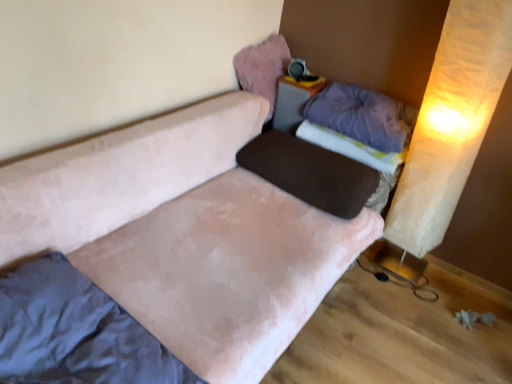
What do you see at coordinates (451, 121) in the screenshot?
I see `beige paper curtain at right` at bounding box center [451, 121].

This screenshot has width=512, height=384. Identify the location of beige paper curtain at right. (451, 121).

What do you see at coordinates (185, 234) in the screenshot?
I see `velvet pink couch at center` at bounding box center [185, 234].

Measure the distance between point (298, 136) and camera.

Point (298, 136) and camera are 7.21 feet apart from each other.

Where is `purple fabric mattress at upper right, the first mattress when ordered from back to front`? The image size is (512, 384). purple fabric mattress at upper right, the first mattress when ordered from back to front is located at coordinates (350, 147).

The height and width of the screenshot is (384, 512). Describe the element at coordinates (293, 101) in the screenshot. I see `matte plastic table at upper center` at that location.

The height and width of the screenshot is (384, 512). What do you see at coordinates (75, 332) in the screenshot?
I see `suede-like beige mattress at lower left, the second mattress in the top-to-bottom sequence` at bounding box center [75, 332].

Describe the element at coordinates (357, 116) in the screenshot. The width and height of the screenshot is (512, 384). I see `purple soft pillow at upper right, the 2th pillow ordered from the bottom` at that location.

I want to click on purple soft pillow at upper right, the 2th pillow ordered from the bottom, so click(x=357, y=116).

At what (x,y) coordinates should I click in order to perform the action: click on velvet pink pillow at upper center, the 1th pillow in the top-to-bottom sequence. Please return your answer as a coordinate pair (x, y). Image resolution: width=512 pixels, height=384 pixels. Looking at the image, I should click on (263, 68).

What do you see at coordinates (310, 172) in the screenshot?
I see `brown fabric pillow at center, which ranks as the first pillow in bottom-to-top order` at bounding box center [310, 172].

The height and width of the screenshot is (384, 512). Find the location of `beige paper curtain at right`. beige paper curtain at right is located at coordinates (451, 121).

Considering the positions of points (412, 203) and (314, 90), is point (412, 203) closer to camera compared to point (314, 90)?

Yes.

You are a GUI agent. You are given a task and a screenshot of the screen. Output one action in this format:
    pyautogui.click(x=<x>, y=<y>)
    Task: Click on the table above the beige paper curtain at right (from the image's perspective)
    This screenshot has width=512, height=384.
    Given the screenshot: What is the action you would take?
    293,101

Which is behind, beige paper curtain at right or matte plastic table at upper center?

matte plastic table at upper center is further away from the camera.

Is beige paper curtain at right looking in the opposite direction of matte plastic table at upper center?

beige paper curtain at right is not turned away from matte plastic table at upper center.

From the image's perspective, which object appears higher, velvet pink pillow at upper center, arranged as the third pillow when ordered from the bottom, or matte plastic table at upper center?

velvet pink pillow at upper center, arranged as the third pillow when ordered from the bottom, appears higher in the image.

Could you tell me if velvet pink pillow at upper center, the 1th pillow in the top-to-bottom sequence, is turned towards matte plastic table at upper center?

No.

Considering the points (266, 54) and (317, 80), which point is behind, point (266, 54) or point (317, 80)?

The point (266, 54) is farther.

In the scene shown: Who is taller, velvet pink pillow at upper center, arranged as the third pillow when ordered from the bottom, or matte plastic table at upper center?

With more height is matte plastic table at upper center.

From a real-world perspective, is velvet pink pillow at upper center, arranged as the third pillow when ordered from the bottom, located beneath brown fabric pillow at center, the 3th pillow viewed from the top?

No, from a real-world perspective, velvet pink pillow at upper center, arranged as the third pillow when ordered from the bottom, is not below brown fabric pillow at center, the 3th pillow viewed from the top.

Is velvet pink pillow at upper center, the 1th pillow in the top-to-bottom sequence, facing towards brown fabric pillow at center, which ranks as the first pillow in bottom-to-top order?

No, velvet pink pillow at upper center, the 1th pillow in the top-to-bottom sequence, is not aimed at brown fabric pillow at center, which ranks as the first pillow in bottom-to-top order.

In the scene shown: Is velvet pink pillow at upper center, arranged as the third pillow when ordered from the bottom, touching brown fabric pillow at center, which ranks as the first pillow in bottom-to-top order?

No, velvet pink pillow at upper center, arranged as the third pillow when ordered from the bottom, is not touching brown fabric pillow at center, which ranks as the first pillow in bottom-to-top order.

Considering the sizes of beige paper curtain at right and purple fabric mattress at upper right, the 1th mattress from the top, in the image, is beige paper curtain at right taller or shorter than purple fabric mattress at upper right, the 1th mattress from the top,?

Considering their sizes, beige paper curtain at right has more height than purple fabric mattress at upper right, the 1th mattress from the top.

From the image's perspective, does beige paper curtain at right appear higher than purple fabric mattress at upper right, the first mattress when ordered from back to front?

No.

Image resolution: width=512 pixels, height=384 pixels. I want to click on curtain on the right side of purple fabric mattress at upper right, which is the first mattress in right-to-left order, so click(451, 121).

Considering the points (483, 38) and (319, 135), which point is in front, point (483, 38) or point (319, 135)?

The point (483, 38) is closer to the camera.

Considering the sizes of objects suede-like beige mattress at lower left, the 2th mattress from the right, and velvet pink couch at center in the image provided, who is smaller, suede-like beige mattress at lower left, the 2th mattress from the right, or velvet pink couch at center?

With smaller size is suede-like beige mattress at lower left, the 2th mattress from the right.

In the image, is suede-like beige mattress at lower left, the 2th mattress from the right, positioned in front of or behind velvet pink couch at center?

Clearly, suede-like beige mattress at lower left, the 2th mattress from the right, is behind velvet pink couch at center.

From the image's perspective, is suede-like beige mattress at lower left, the 2th mattress from the right, positioned above or below velvet pink couch at center?

Based on their image positions, suede-like beige mattress at lower left, the 2th mattress from the right, is located beneath velvet pink couch at center.

From the image's perspective, who appears lower, velvet pink couch at center or purple soft pillow at upper right, the 2th pillow ordered from the bottom?

From the image's view, velvet pink couch at center is below.

Considering the relative sizes of velvet pink couch at center and purple soft pillow at upper right, which appears as the 2th pillow when viewed from the top, in the image provided, is velvet pink couch at center thinner than purple soft pillow at upper right, which appears as the 2th pillow when viewed from the top,?

No.

Is velvet pink couch at center directly adjacent to purple soft pillow at upper right, which appears as the 2th pillow when viewed from the top?

No, velvet pink couch at center is not making contact with purple soft pillow at upper right, which appears as the 2th pillow when viewed from the top.

Is velvet pink couch at center further to the viewer compared to purple soft pillow at upper right, which appears as the 2th pillow when viewed from the top?

No, velvet pink couch at center is in front of purple soft pillow at upper right, which appears as the 2th pillow when viewed from the top.

Which of these two, purple soft pillow at upper right, which appears as the 2th pillow when viewed from the top, or velvet pink couch at center, is smaller?

With smaller size is purple soft pillow at upper right, which appears as the 2th pillow when viewed from the top.

From the picture: Which object is wider, purple soft pillow at upper right, which appears as the 2th pillow when viewed from the top, or velvet pink couch at center?

Wider between the two is velvet pink couch at center.

From the image's perspective, does purple soft pillow at upper right, the 2th pillow ordered from the bottom, appear higher than velvet pink couch at center?

Yes, from the image's perspective, purple soft pillow at upper right, the 2th pillow ordered from the bottom, is over velvet pink couch at center.

The image size is (512, 384). Find the location of `table lying above the beige paper curtain at right (from the image's perspective)`. table lying above the beige paper curtain at right (from the image's perspective) is located at coordinates (293, 101).

This screenshot has height=384, width=512. I want to click on table located on the right of velvet pink pillow at upper center, arranged as the third pillow when ordered from the bottom, so click(x=293, y=101).

When comparing their distances from matte plastic table at upper center, does velvet pink pillow at upper center, the 1th pillow in the top-to-bottom sequence, or purple fabric mattress at upper right, which is the first mattress in right-to-left order, seem closer?

velvet pink pillow at upper center, the 1th pillow in the top-to-bottom sequence.

Considering their positions, is suede-like beige mattress at lower left, which is the 1th mattress from front to back, positioned closer to matte plastic table at upper center than purple fabric mattress at upper right, which is the first mattress in right-to-left order?

The object closer to matte plastic table at upper center is purple fabric mattress at upper right, which is the first mattress in right-to-left order.

From the picture: From the image, which object appears to be farther from velvet pink pillow at upper center, the 1th pillow in the top-to-bottom sequence, velvet pink couch at center or matte plastic table at upper center?

velvet pink couch at center is further to velvet pink pillow at upper center, the 1th pillow in the top-to-bottom sequence.

When comparing their distances from purple fabric mattress at upper right, which ranks as the second mattress in left-to-right order, does matte plastic table at upper center or velvet pink couch at center seem closer?

matte plastic table at upper center is closer to purple fabric mattress at upper right, which ranks as the second mattress in left-to-right order.

Considering their positions, is suede-like beige mattress at lower left, arranged as the second mattress when viewed from the back, positioned closer to purple soft pillow at upper right, the 2th pillow ordered from the bottom, than velvet pink pillow at upper center, arranged as the third pillow when ordered from the bottom?

Based on the image, velvet pink pillow at upper center, arranged as the third pillow when ordered from the bottom, appears to be nearer to purple soft pillow at upper right, the 2th pillow ordered from the bottom.

Considering their positions, is suede-like beige mattress at lower left, the 2th mattress from the right, positioned further to beige paper curtain at right than velvet pink pillow at upper center, arranged as the third pillow when ordered from the bottom?

Based on the image, suede-like beige mattress at lower left, the 2th mattress from the right, appears to be further to beige paper curtain at right.

Estimate the real-world distances between objects in this image. Which object is closer to velvet pink couch at center, matte plastic table at upper center or brown fabric pillow at center, the 3th pillow viewed from the top?

brown fabric pillow at center, the 3th pillow viewed from the top, is positioned closer to the anchor velvet pink couch at center.

When comparing their distances from velvet pink pillow at upper center, the 1th pillow in the top-to-bottom sequence, does beige paper curtain at right or purple soft pillow at upper right, the 2th pillow ordered from the bottom, seem closer?

Answer: Based on the image, purple soft pillow at upper right, the 2th pillow ordered from the bottom, appears to be nearer to velvet pink pillow at upper center, the 1th pillow in the top-to-bottom sequence.

The width and height of the screenshot is (512, 384). What are the coordinates of `pillow between brown fabric pillow at center, the 3th pillow viewed from the top, and beige paper curtain at right, in the horizontal direction` in the screenshot? It's located at (357, 116).

The height and width of the screenshot is (384, 512). What are the coordinates of `table located between velvet pink pillow at upper center, the 1th pillow in the top-to-bottom sequence, and beige paper curtain at right in the left-right direction` in the screenshot? It's located at coord(293,101).

You are a GUI agent. You are given a task and a screenshot of the screen. Output one action in this format:
    pyautogui.click(x=<x>, y=<y>)
    Task: Click on the mattress between velvet pink pillow at upper center, arranged as the third pillow when ordered from the bottom, and beige paper curtain at right from left to right
    
    Given the screenshot: What is the action you would take?
    pyautogui.click(x=350, y=147)

Where is `mattress between suede-like beige mattress at lower left, arranged as the second mattress when viewed from the back, and beige paper curtain at right`? mattress between suede-like beige mattress at lower left, arranged as the second mattress when viewed from the back, and beige paper curtain at right is located at coordinates (350, 147).